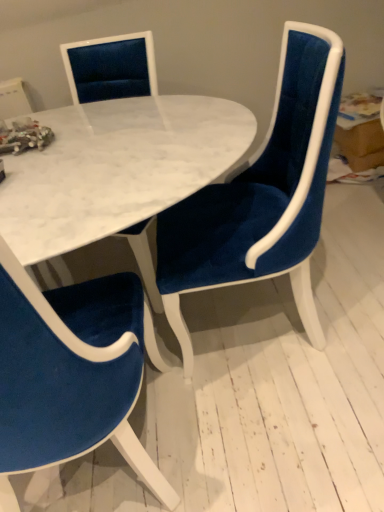
This screenshot has width=384, height=512. In order to click on spots to the right of velvet blue chair at lower left, positioned as the second chair in right-to-left order in this screenshot , I will do `click(281, 451)`.